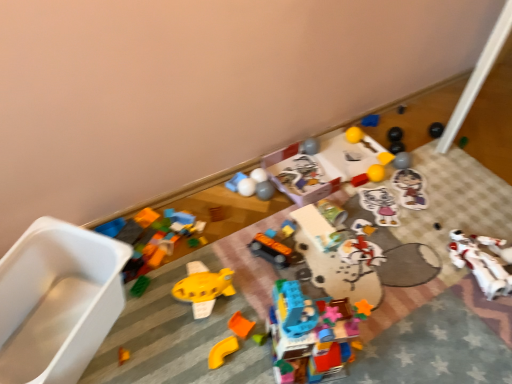
You are a GUI agent. You are given a task and a screenshot of the screen. Output one action in this format:
    pyautogui.click(x=<x>, y=<y>)
    Task: Click on the vacant space that is in between white plastic robot at lower right, the first toy positioned from the right, and yellow matte toy boat at center, positioned as the second toy in left-to-right order
    The height and width of the screenshot is (384, 512).
    Given the screenshot: What is the action you would take?
    pyautogui.click(x=366, y=278)